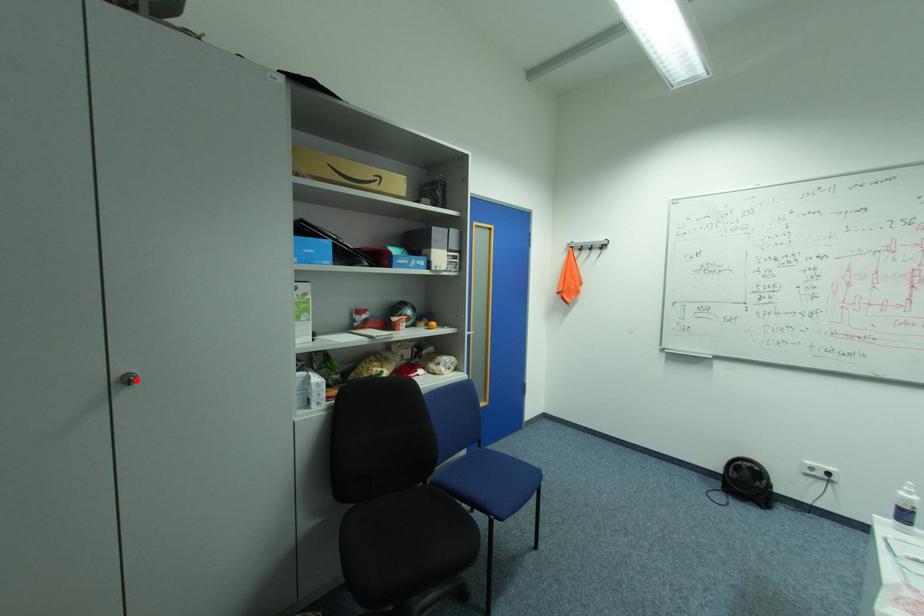
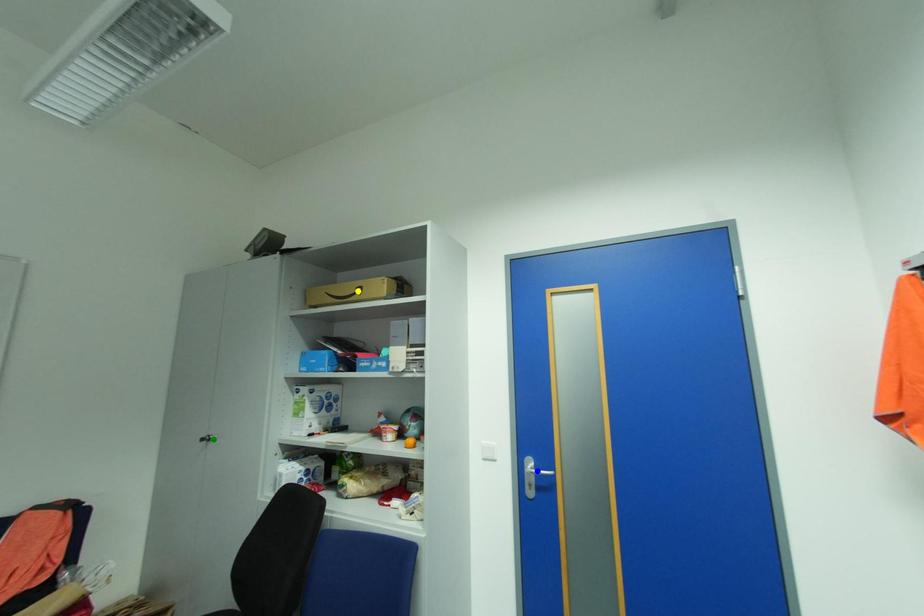
Question: I am providing you with two images of the same scene from different viewpoints. A red point is marked on the first image. You are given multiple points on the second image. Which point in image 2 is actually the same real-world point as the red point in image 1?

Choices:
 (A) blue point
 (B) yellow point
 (C) green point

Answer: (C)